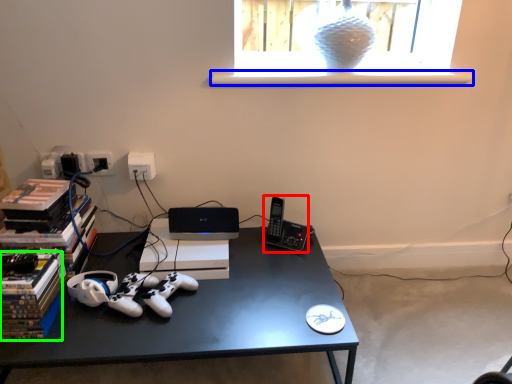
Question: Considering the real-world distances, which object is farthest from gadget (highlighted by a red box)? window sill (highlighted by a blue box) or paperback book (highlighted by a green box)?

Choices:
 (A) window sill
 (B) paperback book

Answer: (B)